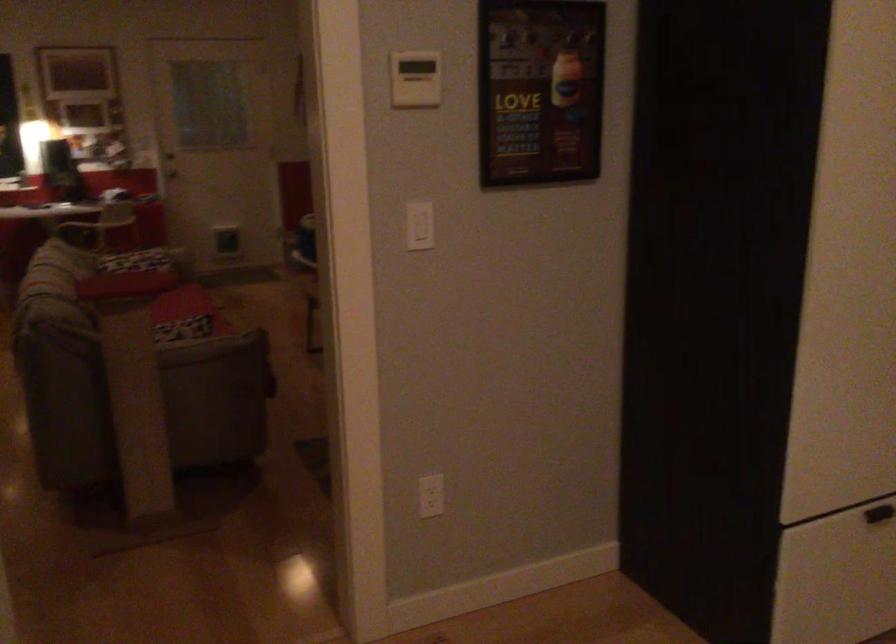
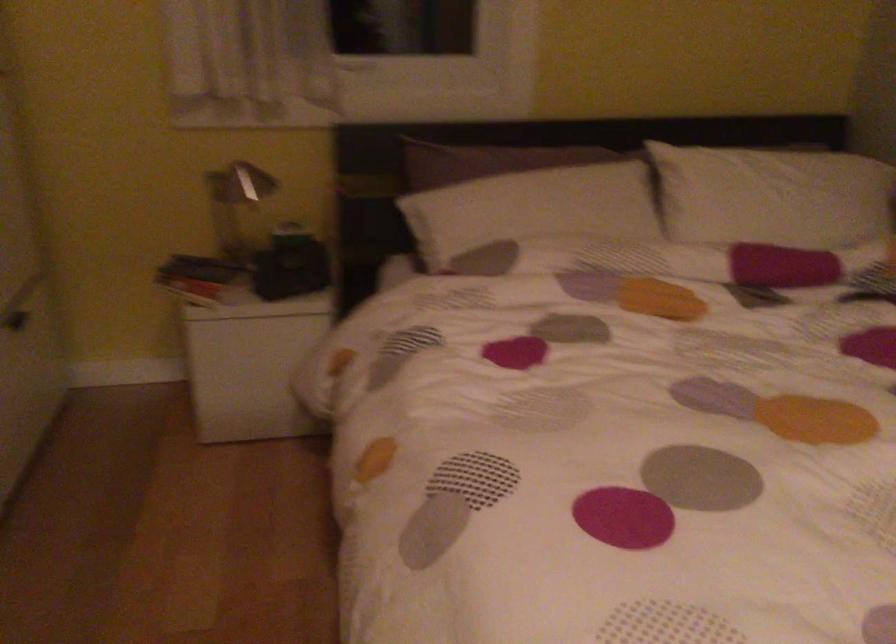
Based on the continuous images, in which direction is the camera rotating?

The camera rotated toward right-down.